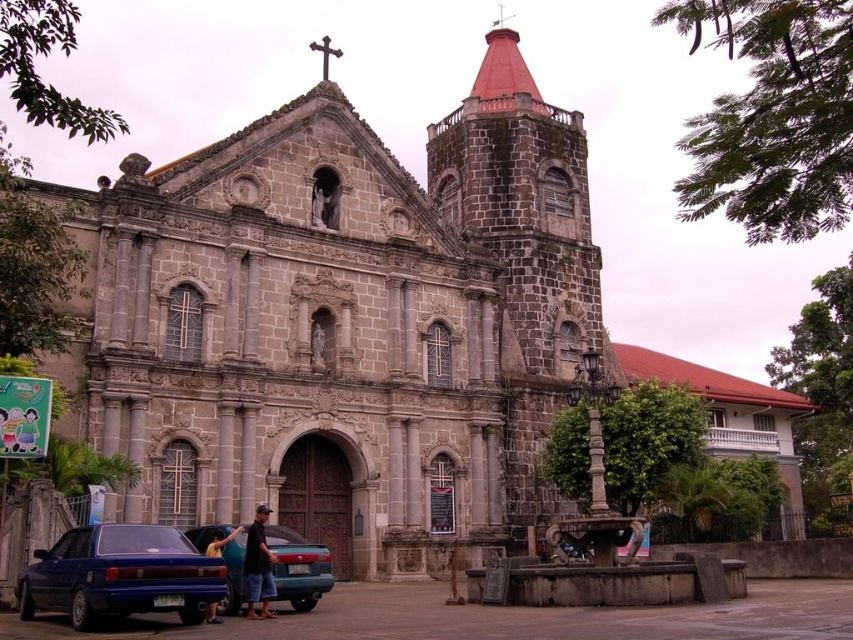
Question: Which object appears closest to the camera in this image?

Choices:
 (A) shiny blue sedan at lower left
 (B) blue metallic car at lower left
 (C) dark blue denim shorts at lower center
 (D) yellow fabric shirt at lower left

Answer: (A)

Question: Considering the real-world distances, which object is farthest from the yellow fabric shirt at lower left?

Choices:
 (A) shiny blue sedan at lower left
 (B) dark blue denim shorts at lower center

Answer: (A)

Question: Does dark blue denim shorts at lower center have a greater width compared to yellow fabric shirt at lower left?

Choices:
 (A) no
 (B) yes

Answer: (B)

Question: Among these points, which one is nearest to the camera?

Choices:
 (A) (190, 595)
 (B) (219, 540)
 (C) (265, 580)

Answer: (A)

Question: Is blue metallic car at lower left wider than yellow fabric shirt at lower left?

Choices:
 (A) no
 (B) yes

Answer: (B)

Question: Does shiny blue sedan at lower left appear on the left side of yellow fabric shirt at lower left?

Choices:
 (A) no
 (B) yes

Answer: (B)